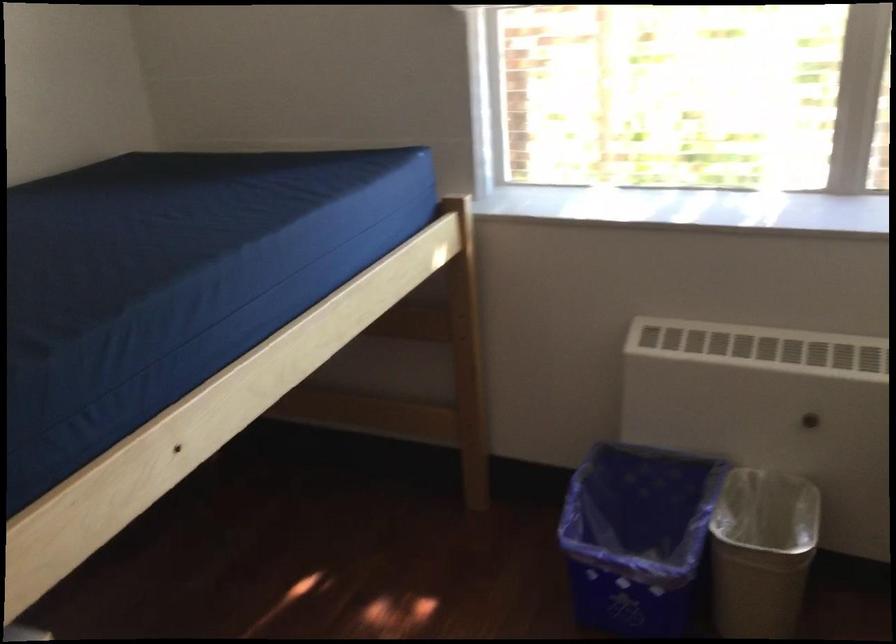
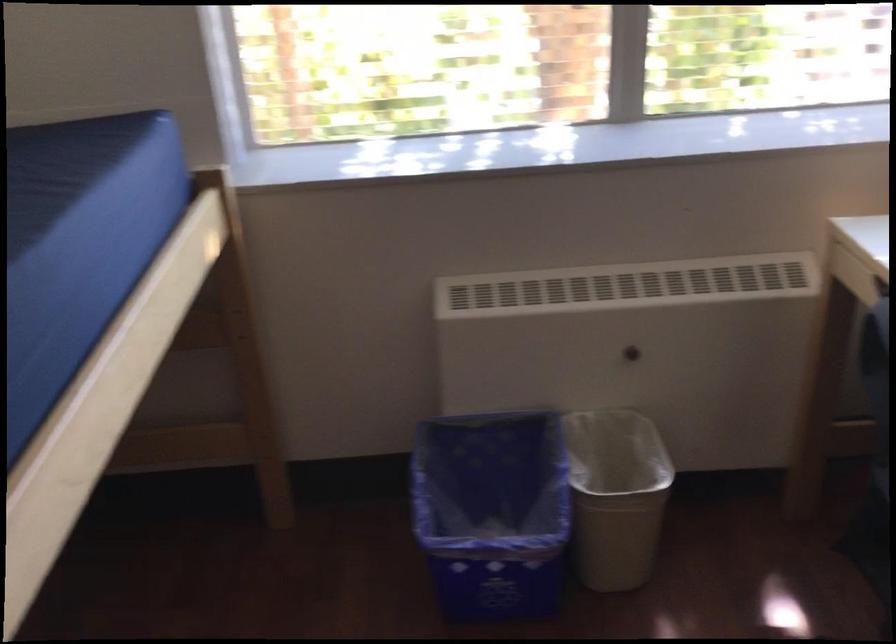
Find the pixel in the second image that matches (x=649, y=542) in the first image.

(492, 512)